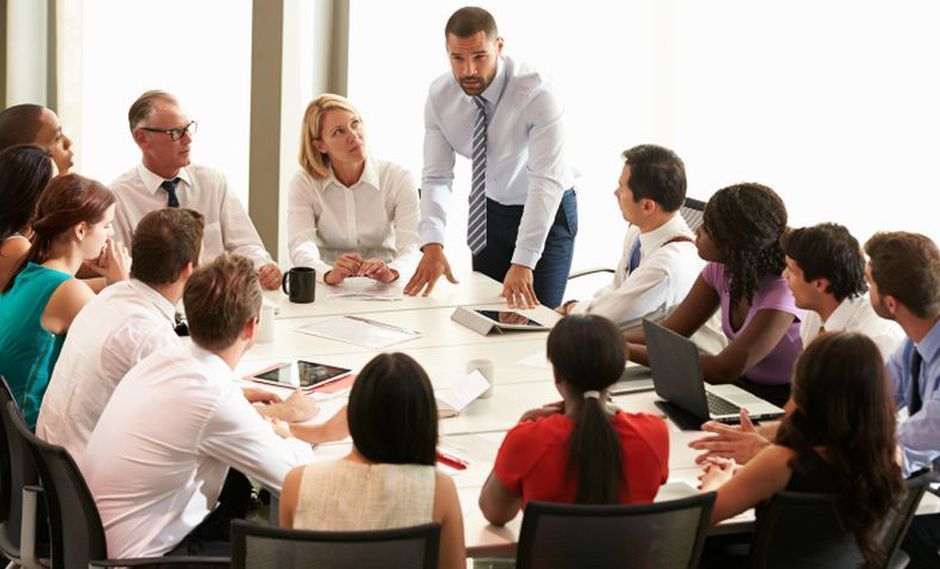
At what (x,y) coordinates should I click in order to perform the action: click on table panels. Please return your answer as a coordinate pair (x, y). Looking at the image, I should click on (493, 447), (500, 402), (500, 368), (420, 336), (411, 303).